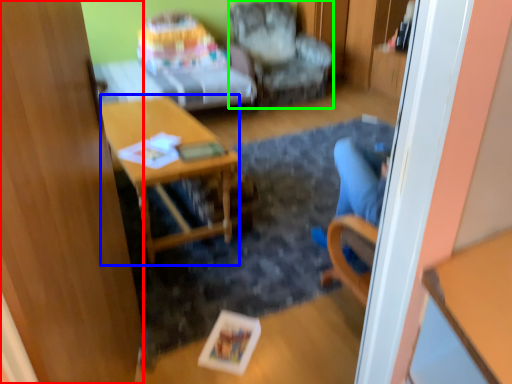
Question: Based on their relative distances, which object is nearer to glass door (highlighted by a red box)? Choose from desk (highlighted by a blue box) and chair (highlighted by a green box).

Choices:
 (A) desk
 (B) chair

Answer: (A)